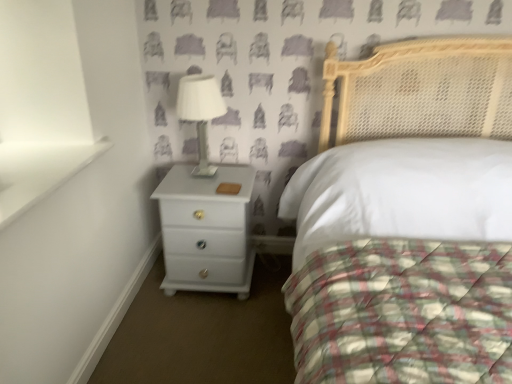
Question: Is white glossy chest of drawers at lower left located within white glossy table lamp at upper center?

Choices:
 (A) no
 (B) yes

Answer: (A)

Question: Does white glossy table lamp at upper center appear on the left side of white glossy chest of drawers at lower left?

Choices:
 (A) no
 (B) yes

Answer: (B)

Question: Does white glossy table lamp at upper center lie in front of white glossy chest of drawers at lower left?

Choices:
 (A) yes
 (B) no

Answer: (A)

Question: From a real-world perspective, is white glossy table lamp at upper center beneath white glossy chest of drawers at lower left?

Choices:
 (A) yes
 (B) no

Answer: (B)

Question: Is white glossy table lamp at upper center to the right of white glossy chest of drawers at lower left from the viewer's perspective?

Choices:
 (A) yes
 (B) no

Answer: (B)

Question: Looking at their shapes, would you say white glossy bed at center is wider or thinner than white glossy table lamp at upper center?

Choices:
 (A) wide
 (B) thin

Answer: (A)

Question: From the image's perspective, relative to white glossy table lamp at upper center, is white glossy bed at center above or below?

Choices:
 (A) above
 (B) below

Answer: (B)

Question: Would you say white glossy bed at center is to the left or to the right of white glossy table lamp at upper center in the picture?

Choices:
 (A) left
 (B) right

Answer: (B)

Question: Considering the positions of point (444, 327) and point (202, 135), is point (444, 327) closer or farther from the camera than point (202, 135)?

Choices:
 (A) closer
 (B) farther

Answer: (A)

Question: In terms of size, does white glossy chest of drawers at lower left appear bigger or smaller than white glossy bed at center?

Choices:
 (A) big
 (B) small

Answer: (B)

Question: Does point (244, 274) appear closer or farther from the camera than point (480, 334)?

Choices:
 (A) closer
 (B) farther

Answer: (B)

Question: From the image's perspective, is white glossy chest of drawers at lower left above or below white glossy bed at center?

Choices:
 (A) below
 (B) above

Answer: (B)

Question: From their relative heights in the image, would you say white glossy chest of drawers at lower left is taller or shorter than white glossy bed at center?

Choices:
 (A) tall
 (B) short

Answer: (B)

Question: In the image, is white glossy bed at center positioned in front of or behind white glossy chest of drawers at lower left?

Choices:
 (A) behind
 (B) front

Answer: (B)

Question: From a real-world perspective, is white glossy bed at center physically located above or below white glossy chest of drawers at lower left?

Choices:
 (A) below
 (B) above

Answer: (B)